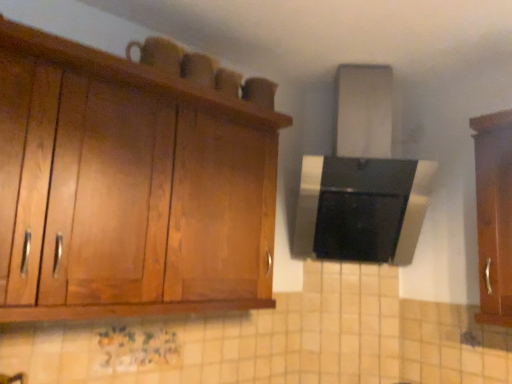
Question: From the image's perspective, relative to wooden cabinet at right, which is the 2th cabinetry in left-to-right order, is wooden cabinet at upper left, the second cabinetry from the right, above or below?

Choices:
 (A) above
 (B) below

Answer: (A)

Question: In terms of width, does wooden cabinet at upper left, arranged as the 1th cabinetry when viewed from the left, look wider or thinner when compared to wooden cabinet at right, which is the 2th cabinetry in left-to-right order?

Choices:
 (A) thin
 (B) wide

Answer: (B)

Question: Based on their positions, is wooden cabinet at upper left, the second cabinetry from the right, located to the left or right of wooden cabinet at right, which is the 2th cabinetry in left-to-right order?

Choices:
 (A) right
 (B) left

Answer: (B)

Question: Is point (487, 195) closer or farther from the camera than point (96, 125)?

Choices:
 (A) closer
 (B) farther

Answer: (B)

Question: In the image, is wooden cabinet at right, which is the 1th cabinetry from right to left, positioned in front of or behind wooden cabinet at upper left, arranged as the 1th cabinetry when viewed from the left?

Choices:
 (A) behind
 (B) front

Answer: (A)

Question: From a real-world perspective, relative to wooden cabinet at upper left, arranged as the 1th cabinetry when viewed from the left, is wooden cabinet at right, which is the 2th cabinetry in left-to-right order, vertically above or below?

Choices:
 (A) above
 (B) below

Answer: (A)

Question: Would you say wooden cabinet at right, which is the 1th cabinetry from right to left, is inside or outside wooden cabinet at upper left, arranged as the 1th cabinetry when viewed from the left?

Choices:
 (A) outside
 (B) inside

Answer: (A)